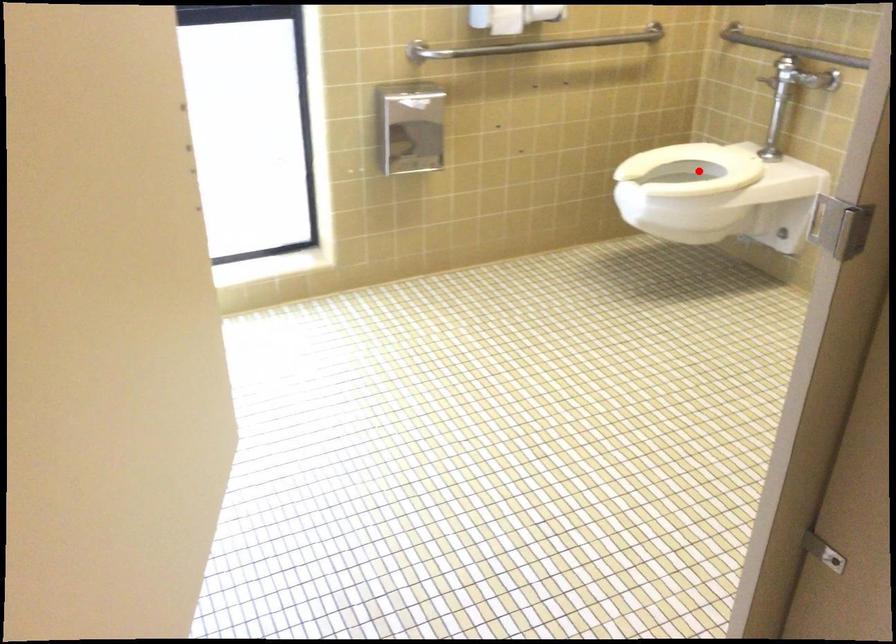
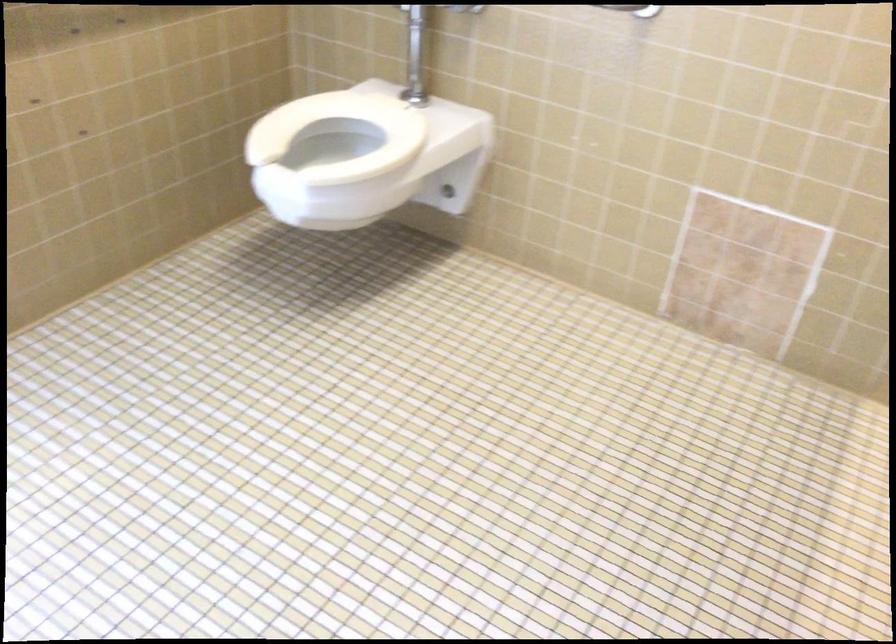
Question: I am providing you with two images of the same scene from different viewpoints. Image1 has a red point marked. In image2, the corresponding 3D location appears at what relative position? Reply with the corresponding letter.

Choices:
 (A) Closer
 (B) Farther

Answer: (A)